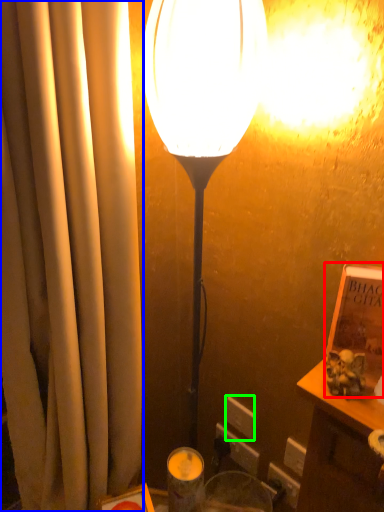
Question: Which is nearer to the book (highlighted by a red box)? curtain (highlighted by a blue box) or electric outlet (highlighted by a green box).

Choices:
 (A) curtain
 (B) electric outlet

Answer: (A)